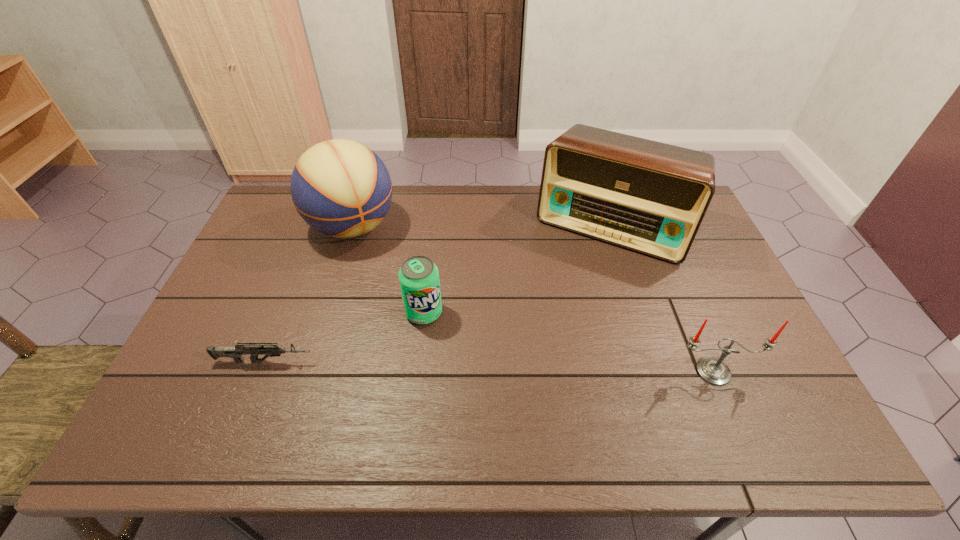
You are a GUI agent. You are given a task and a screenshot of the screen. Output one action in this format:
    pyautogui.click(x=<x>, y=<y>)
    Task: Click on the vacant space located 0.170m on the front-facing side of the radio receiver
    This screenshot has height=540, width=960.
    Given the screenshot: What is the action you would take?
    pyautogui.click(x=567, y=298)

This screenshot has height=540, width=960. I want to click on vacant space located on the front-facing side of the radio receiver, so click(x=555, y=323).

I want to click on free space located on the front-facing side of the radio receiver, so click(x=551, y=330).

Identify the location of vacant space located on the front-facing side of the second shortest object. Image resolution: width=960 pixels, height=540 pixels. (482, 396).

The height and width of the screenshot is (540, 960). I want to click on vacant region located 0.190m on the front-facing side of the second shortest object, so click(468, 377).

What are the coordinates of `vacant space positioned on the front-facing side of the second shortest object` in the screenshot? It's located at (486, 403).

Identify the location of basketball at the far edge. point(341,188).

Find the location of a particular element. radio receiver present at the far edge is located at coordinates (650, 197).

Locate an element on the screen. object that is at the near edge is located at coordinates (714, 371).

Where is `gun located in the left edge section of the desktop`? gun located in the left edge section of the desktop is located at coordinates (236, 352).